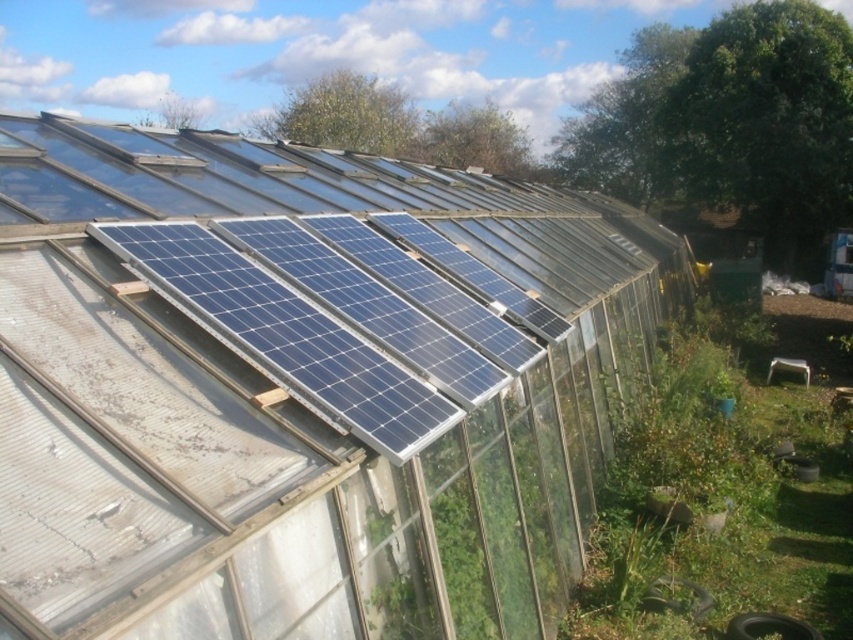
You are standing inside the greenhouse and looking up at the roof. You notice a point marked at coordinates (303, 388). What object is located at that point?

The point at coordinates (303, 388) marks the location of the blue solar panels at upper center.

You are a maintenance worker inspecting the greenhouse roof. You notice two types of solar panels at the upper center area. Which one has a larger size between the blue solar panels at upper center and the blue glossy solar panels at upper center?

The blue solar panels at upper center has a larger size compared to the blue glossy solar panels at upper center.

You are a maintenance worker in the greenhouse. You need to clean the blue solar panels at upper center and the blue glossy solar panels at upper center. Which one should you clean first if you want to start from the highest point?

The blue solar panels at upper center is above the blue glossy solar panels at upper center, so you should clean the blue solar panels at upper center first.